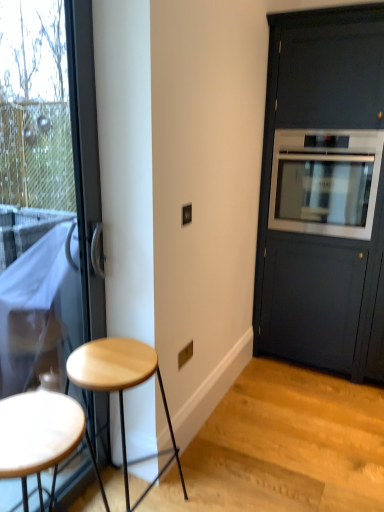
Question: Does wooden stool at left, marked as the first stool in a front-to-back arrangement, touch satin silver oven at right?

Choices:
 (A) yes
 (B) no

Answer: (B)

Question: Is wooden stool at left, marked as the first stool in a front-to-back arrangement, facing towards satin silver oven at right?

Choices:
 (A) no
 (B) yes

Answer: (A)

Question: Is the depth of wooden stool at left, which appears as the second stool when viewed from the back, greater than that of satin silver oven at right?

Choices:
 (A) no
 (B) yes

Answer: (A)

Question: Is wooden stool at left, marked as the first stool in a front-to-back arrangement, outside of satin silver oven at right?

Choices:
 (A) yes
 (B) no

Answer: (A)

Question: From a real-world perspective, is wooden stool at left, which appears as the second stool when viewed from the back, over satin silver oven at right?

Choices:
 (A) yes
 (B) no

Answer: (B)

Question: Is wooden stool at left, marked as the first stool in a front-to-back arrangement, looking in the opposite direction of satin silver oven at right?

Choices:
 (A) no
 (B) yes

Answer: (A)

Question: Is transparent glass door at left placed right next to matte black cabinet at right?

Choices:
 (A) no
 (B) yes

Answer: (A)

Question: Is the depth of transparent glass door at left greater than that of matte black cabinet at right?

Choices:
 (A) yes
 (B) no

Answer: (B)

Question: From a real-world perspective, does transparent glass door at left stand above matte black cabinet at right?

Choices:
 (A) yes
 (B) no

Answer: (B)

Question: From a real-world perspective, is transparent glass door at left beneath matte black cabinet at right?

Choices:
 (A) yes
 (B) no

Answer: (A)

Question: Is transparent glass door at left to the left of matte black cabinet at right from the viewer's perspective?

Choices:
 (A) yes
 (B) no

Answer: (A)

Question: Is the depth of transparent glass door at left less than that of matte black cabinet at right?

Choices:
 (A) yes
 (B) no

Answer: (A)

Question: Is matte black cabinet at right facing away from light wood stool at lower left, the first stool from the back?

Choices:
 (A) no
 (B) yes

Answer: (A)